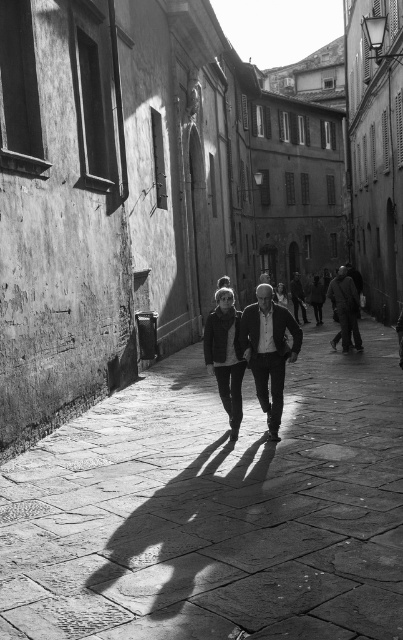
Question: Which point appears closest to the camera in this image?

Choices:
 (A) (8, 518)
 (B) (236, 317)
 (C) (270, 368)

Answer: (A)

Question: Can you confirm if smooth stone pavement at center is wider than dark textured coat at right?

Choices:
 (A) yes
 (B) no

Answer: (A)

Question: Is smooth black jacket at center wider than dark textured coat at right?

Choices:
 (A) no
 (B) yes

Answer: (A)

Question: Considering the real-world distances, which object is farthest from the smooth black jacket at center?

Choices:
 (A) matte black jacket at center
 (B) dark textured coat at right
 (C) smooth stone pavement at center

Answer: (B)

Question: Based on their relative distances, which object is farther from the dark textured coat at right?

Choices:
 (A) smooth black jacket at center
 (B) smooth stone pavement at center
 (C) matte black jacket at center

Answer: (C)

Question: Does smooth black jacket at center appear on the right side of matte black jacket at center?

Choices:
 (A) yes
 (B) no

Answer: (A)